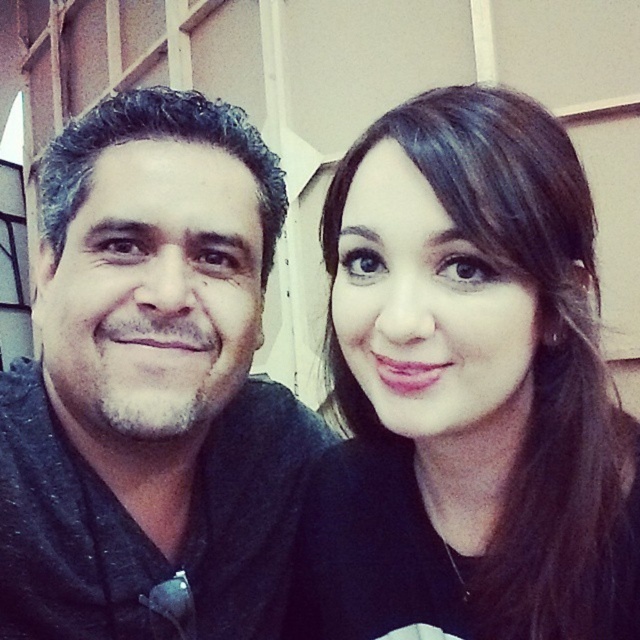
You are a photographer trying to adjust the lighting for a photo shoot. You notice a point at coordinates (467, 392) in the image. What object does this point correspond to?

The point at coordinates (467, 392) corresponds to the black matte hair at upper right.

You are a photographer trying to adjust the focus of your camera to capture both the black matte hair at upper right and the dark gray fabric shirt at left clearly. Which object should you focus on first to ensure it appears sharp in the photo?

The black matte hair at upper right is smaller than the dark gray fabric shirt at left, so you should focus on the dark gray fabric shirt at left first because it is larger and easier to capture sharply.

You are a photographer adjusting the lighting for a portrait. You notice the black matte hair at upper right and the dark gray fabric shirt at left. Which object is positioned lower in the frame?

The black matte hair at upper right is located below dark gray fabric shirt at left, so the black matte hair at upper right is positioned lower in the frame.